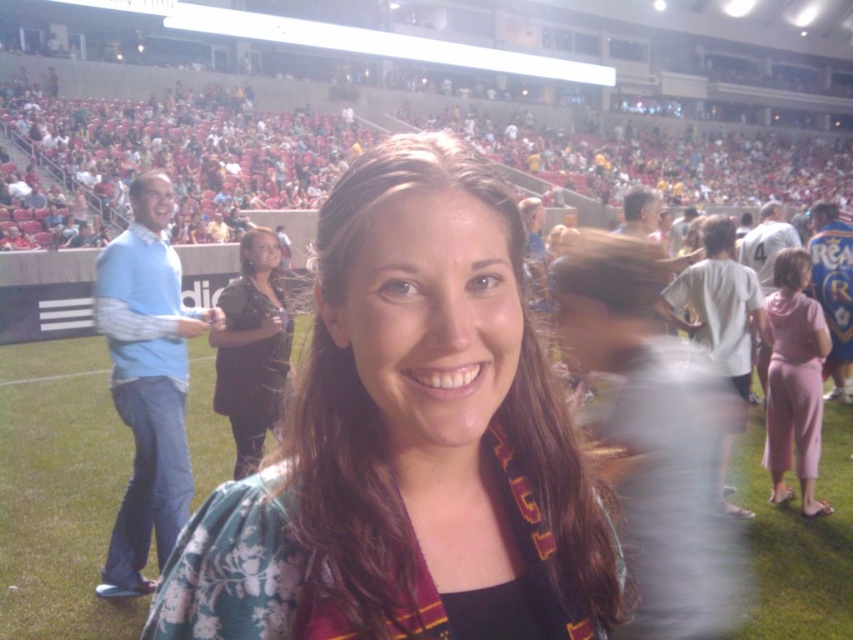
Question: Where is light blue sweater at left located in relation to pink fabric pants at right in the image?

Choices:
 (A) above
 (B) below

Answer: (A)

Question: Which of the following is the closest to the observer?

Choices:
 (A) light blue sweater at left
 (B) pink fabric pants at right
 (C) floral fabric shirt at center

Answer: (C)

Question: Which object is farther from the camera taking this photo?

Choices:
 (A) black satin dress at center
 (B) pink fabric pants at right
 (C) floral fabric shirt at center

Answer: (B)

Question: Among these points, which one is farthest from the camera?

Choices:
 (A) (490, 120)
 (B) (276, 368)
 (C) (364, 346)

Answer: (A)

Question: From the image, what is the correct spatial relationship of floral fabric shirt at center in relation to light blue sweater at left?

Choices:
 (A) left
 (B) right

Answer: (B)

Question: Observing the image, what is the correct spatial positioning of floral fabric shirt at center in reference to light blue sweater at left?

Choices:
 (A) right
 (B) left

Answer: (A)